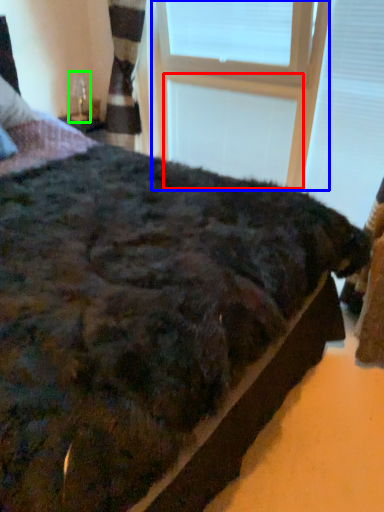
Question: Which object is positioned closest to window frame (highlighted by a red box)? Select from window frame (highlighted by a blue box) and table lamp (highlighted by a green box).

Choices:
 (A) window frame
 (B) table lamp

Answer: (A)